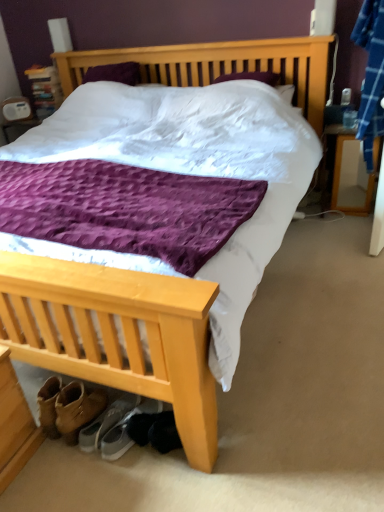
The image size is (384, 512). Describe the element at coordinates (107, 422) in the screenshot. I see `gray suede sneakers at lower left, positioned as the first footwear in left-to-right order` at that location.

The image size is (384, 512). What do you see at coordinates (352, 174) in the screenshot? I see `wooden nightstand at right` at bounding box center [352, 174].

What are the coordinates of `gray fabric sneakers at lower center, placed as the 2th footwear when sorted from left to right` in the screenshot? It's located at (126, 430).

Find the location of a particular element. gray suede sneakers at lower left, the second footwear from the right is located at coordinates (107, 422).

In the image, is wooden nightstand at right positioned in front of or behind gray fabric sneakers at lower center, which is the first footwear in right-to-left order?

In the image, wooden nightstand at right appears behind gray fabric sneakers at lower center, which is the first footwear in right-to-left order.

Measure the distance from wooden nightstand at right to gray fabric sneakers at lower center, placed as the 2th footwear when sorted from left to right.

They are 7.08 feet apart.

Is wooden nightstand at right shorter than gray fabric sneakers at lower center, placed as the 2th footwear when sorted from left to right?

No.

Does wooden nightstand at right have a larger size compared to gray fabric sneakers at lower center, which is the first footwear in right-to-left order?

Correct, wooden nightstand at right is larger in size than gray fabric sneakers at lower center, which is the first footwear in right-to-left order.

Between wooden nightstand at right and gray suede sneakers at lower left, positioned as the first footwear in left-to-right order, which one has smaller width?

wooden nightstand at right.

Can you tell me how much wooden nightstand at right and gray suede sneakers at lower left, positioned as the first footwear in left-to-right order, differ in facing direction?

There is a 167-degree angle between the facing directions of wooden nightstand at right and gray suede sneakers at lower left, positioned as the first footwear in left-to-right order.

Are wooden nightstand at right and gray suede sneakers at lower left, positioned as the first footwear in left-to-right order, making contact?

No, wooden nightstand at right is not touching gray suede sneakers at lower left, positioned as the first footwear in left-to-right order.

Does point (350, 192) appear closer or farther from the camera than point (121, 401)?

Point (350, 192) is positioned farther from the camera compared to point (121, 401).

Considering the relative positions of gray fabric sneakers at lower center, placed as the 2th footwear when sorted from left to right, and wooden nightstand at right in the image provided, is gray fabric sneakers at lower center, placed as the 2th footwear when sorted from left to right, in front of wooden nightstand at right?

Yes, gray fabric sneakers at lower center, placed as the 2th footwear when sorted from left to right, is in front of wooden nightstand at right.

How different are the orientations of gray fabric sneakers at lower center, placed as the 2th footwear when sorted from left to right, and wooden nightstand at right in degrees?

The facing directions of gray fabric sneakers at lower center, placed as the 2th footwear when sorted from left to right, and wooden nightstand at right are 167 degrees apart.

From the image's perspective, relative to wooden nightstand at right, is gray fabric sneakers at lower center, which is the first footwear in right-to-left order, above or below?

gray fabric sneakers at lower center, which is the first footwear in right-to-left order, is situated lower than wooden nightstand at right in the image.

Could you tell me if gray fabric sneakers at lower center, which is the first footwear in right-to-left order, is turned towards wooden nightstand at right?

Yes, gray fabric sneakers at lower center, which is the first footwear in right-to-left order, faces towards wooden nightstand at right.

From the image's perspective, is gray suede sneakers at lower left, the second footwear from the right, positioned above or below wooden nightstand at right?

From the image's perspective, gray suede sneakers at lower left, the second footwear from the right, appears below wooden nightstand at right.

Is point (122, 405) closer to camera compared to point (334, 176)?

Yes.

Who is bigger, gray suede sneakers at lower left, the second footwear from the right, or wooden nightstand at right?

wooden nightstand at right is bigger.

Is gray suede sneakers at lower left, the second footwear from the right, turned away from wooden nightstand at right?

gray suede sneakers at lower left, the second footwear from the right, does not have its back to wooden nightstand at right.

Could you tell me if gray fabric sneakers at lower center, placed as the 2th footwear when sorted from left to right, is turned towards gray suede sneakers at lower left, the second footwear from the right?

No, gray fabric sneakers at lower center, placed as the 2th footwear when sorted from left to right, is not aimed at gray suede sneakers at lower left, the second footwear from the right.

The height and width of the screenshot is (512, 384). Identify the location of footwear in front of the gray suede sneakers at lower left, the second footwear from the right. (126, 430).

From the picture: Who is shorter, gray fabric sneakers at lower center, which is the first footwear in right-to-left order, or gray suede sneakers at lower left, the second footwear from the right?

With less height is gray fabric sneakers at lower center, which is the first footwear in right-to-left order.

From the image's perspective, is gray fabric sneakers at lower center, which is the first footwear in right-to-left order, located beneath gray suede sneakers at lower left, the second footwear from the right?

Indeed, from the image's perspective, gray fabric sneakers at lower center, which is the first footwear in right-to-left order, is shown beneath gray suede sneakers at lower left, the second footwear from the right.

Does gray suede sneakers at lower left, the second footwear from the right, turn towards gray fabric sneakers at lower center, which is the first footwear in right-to-left order?

No, gray suede sneakers at lower left, the second footwear from the right, does not turn towards gray fabric sneakers at lower center, which is the first footwear in right-to-left order.

Which of these two, gray suede sneakers at lower left, positioned as the first footwear in left-to-right order, or gray fabric sneakers at lower center, which is the first footwear in right-to-left order, is thinner?

Thinner between the two is gray suede sneakers at lower left, positioned as the first footwear in left-to-right order.

From the picture: From a real-world perspective, is gray suede sneakers at lower left, the second footwear from the right, physically above gray fabric sneakers at lower center, placed as the 2th footwear when sorted from left to right?

Yes, from a real-world perspective, gray suede sneakers at lower left, the second footwear from the right, is over gray fabric sneakers at lower center, placed as the 2th footwear when sorted from left to right

Identify the location of nightstand that appears on the right of gray fabric sneakers at lower center, placed as the 2th footwear when sorted from left to right. The height and width of the screenshot is (512, 384). (352, 174).

Where is `the 1st footwear in front of the wooden nightstand at right, starting your count from the anchor`? the 1st footwear in front of the wooden nightstand at right, starting your count from the anchor is located at coordinates (107, 422).

Based on their spatial positions, is gray suede sneakers at lower left, positioned as the first footwear in left-to-right order, or gray fabric sneakers at lower center, which is the first footwear in right-to-left order, further from wooden nightstand at right?

The object further to wooden nightstand at right is gray suede sneakers at lower left, positioned as the first footwear in left-to-right order.

From the image, which object appears to be farther from wooden nightstand at right, gray fabric sneakers at lower center, which is the first footwear in right-to-left order, or gray suede sneakers at lower left, positioned as the first footwear in left-to-right order?

The object further to wooden nightstand at right is gray suede sneakers at lower left, positioned as the first footwear in left-to-right order.

Which object lies nearer to the anchor point gray fabric sneakers at lower center, placed as the 2th footwear when sorted from left to right, gray suede sneakers at lower left, the second footwear from the right, or wooden nightstand at right?

Based on the image, gray suede sneakers at lower left, the second footwear from the right, appears to be nearer to gray fabric sneakers at lower center, placed as the 2th footwear when sorted from left to right.

From the picture: From the image, which object appears to be nearer to gray fabric sneakers at lower center, which is the first footwear in right-to-left order, wooden nightstand at right or gray suede sneakers at lower left, the second footwear from the right?

gray suede sneakers at lower left, the second footwear from the right, is positioned closer to the anchor gray fabric sneakers at lower center, which is the first footwear in right-to-left order.

Looking at the image, which one is located further to gray suede sneakers at lower left, positioned as the first footwear in left-to-right order, wooden nightstand at right or gray fabric sneakers at lower center, placed as the 2th footwear when sorted from left to right?

wooden nightstand at right lies further to gray suede sneakers at lower left, positioned as the first footwear in left-to-right order, than the other object.

When comparing their distances from gray suede sneakers at lower left, positioned as the first footwear in left-to-right order, does gray fabric sneakers at lower center, placed as the 2th footwear when sorted from left to right, or wooden nightstand at right seem further?

Among the two, wooden nightstand at right is located further to gray suede sneakers at lower left, positioned as the first footwear in left-to-right order.

The height and width of the screenshot is (512, 384). What are the coordinates of `footwear between gray suede sneakers at lower left, positioned as the first footwear in left-to-right order, and wooden nightstand at right, in the horizontal direction` in the screenshot? It's located at 126,430.